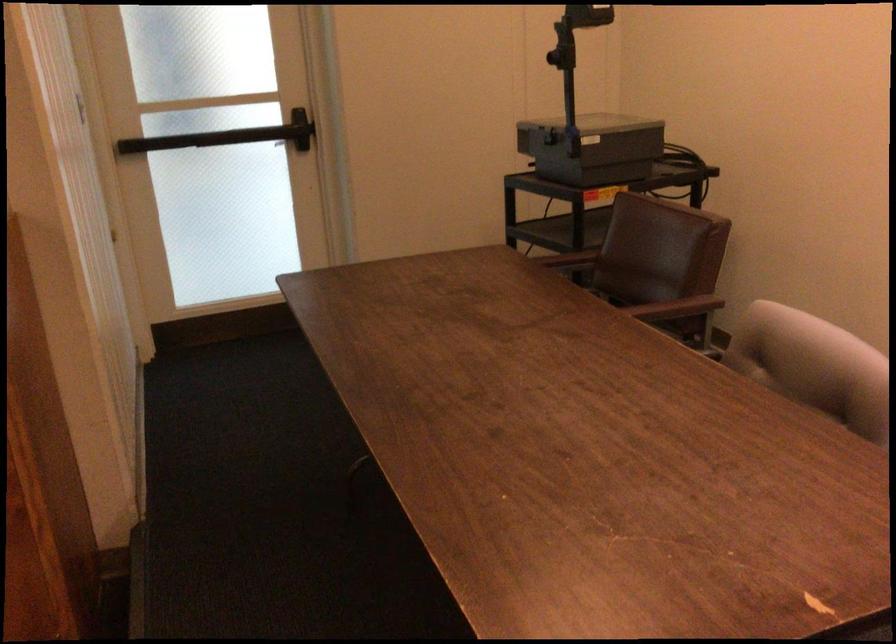
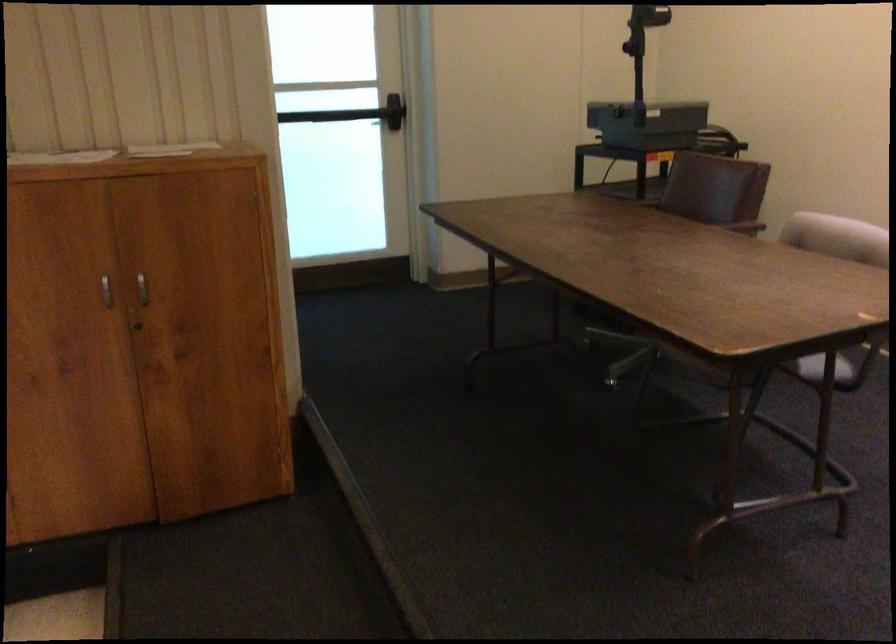
Question: How did the camera likely rotate?

Choices:
 (A) Left
 (B) Right
 (C) Up
 (D) Down

Answer: (C)